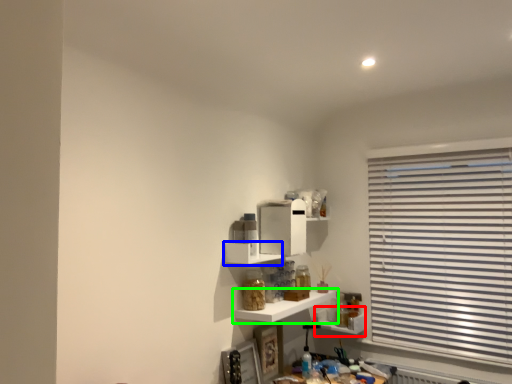
Question: Considering the real-world distances, which object is closest to shelf (highlighted by a red box)? shelf (highlighted by a blue box) or shelf (highlighted by a green box).

Choices:
 (A) shelf
 (B) shelf

Answer: (B)